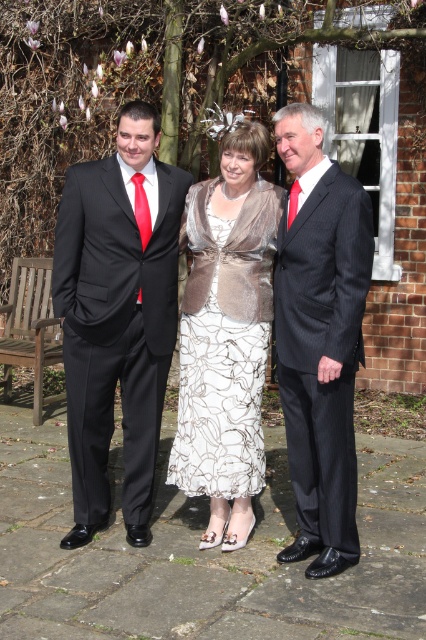
Question: Does matte black suit at center have a lesser width compared to wooden park bench at left?

Choices:
 (A) yes
 (B) no

Answer: (B)

Question: Does dark gray pinstripe suit at center have a smaller size compared to wooden park bench at left?

Choices:
 (A) no
 (B) yes

Answer: (B)

Question: Estimate the real-world distances between objects in this image. Which object is closer to the wooden park bench at left?

Choices:
 (A) matte black suit at center
 (B) silver textured dress at center
 (C) matte black suit at left
 (D) dark gray pinstripe suit at center

Answer: (C)

Question: From the image, what is the correct spatial relationship of matte black suit at center in relation to dark gray pinstripe suit at center?

Choices:
 (A) below
 (B) above

Answer: (A)

Question: Which point is farther to the camera?

Choices:
 (A) dark gray pinstripe suit at center
 (B) matte black suit at left

Answer: (B)

Question: Among these objects, which one is farthest from the camera?

Choices:
 (A) matte black suit at center
 (B) matte black suit at left
 (C) silver textured dress at center
 (D) dark gray pinstripe suit at center

Answer: (C)